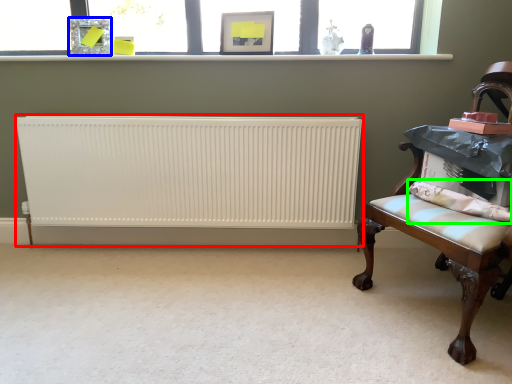
Question: Based on their relative distances, which object is farther from radiator (highlighted by a red box)? Choose from picture frame (highlighted by a blue box) and pillow (highlighted by a green box).

Choices:
 (A) picture frame
 (B) pillow

Answer: (B)